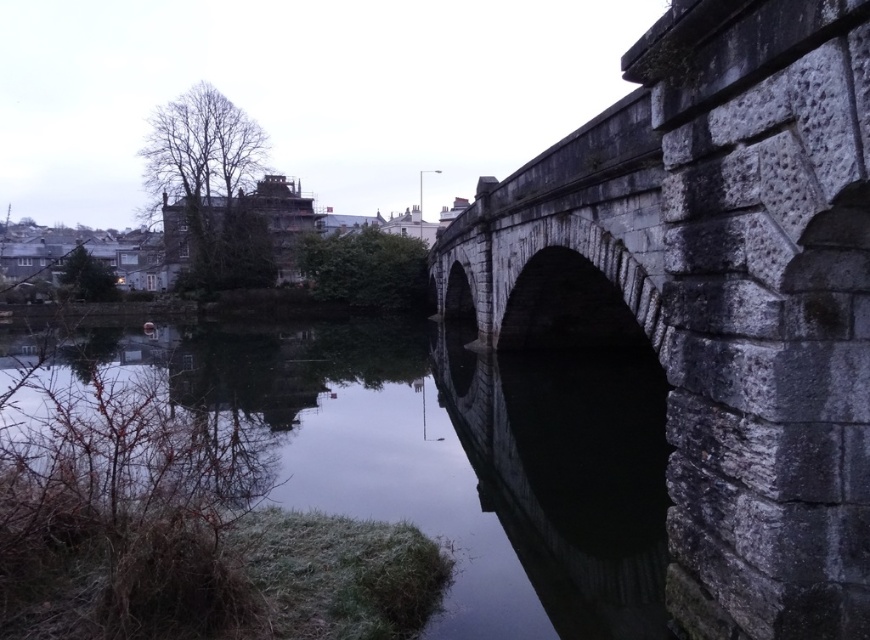
You are a photographer planning to capture the reflection of the gray stone bridge at right in the dark gray stone river at center. Based on the scene description, will the bridge be visible in the river below?

The gray stone bridge at right is above the dark gray stone river at center, so its reflection should be visible in the water since the river is calm and reflective as described in the scene.

You are a photographer planning to capture the gray stone bridge at right and the dark gray stone river at center in a single frame. Given their sizes, which object should you focus on to ensure both are visible without cropping?

Since the gray stone bridge at right has a smaller size compared to the dark gray stone river at center, you should focus on the gray stone bridge at right to ensure both objects are visible in the frame without cropping.

You are standing on the riverside and want to cross the river. The gray stone bridge at right is the only path available. If your backpack is 1.8 meters wide, can you safely walk across the bridge? Please explain your reasoning.

The gray stone bridge at right is 4.03 meters away from you. Since your backpack is 1.8 meters wide, which is significantly narrower than the bridge width, you can safely walk across the bridge as long as you stay centered and avoid the edges.